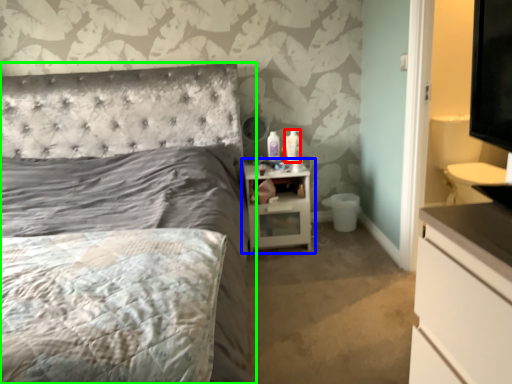
Question: Which object is positioned farthest from toiletry (highlighted by a red box)? Select from nightstand (highlighted by a blue box) and bed (highlighted by a green box).

Choices:
 (A) nightstand
 (B) bed

Answer: (B)